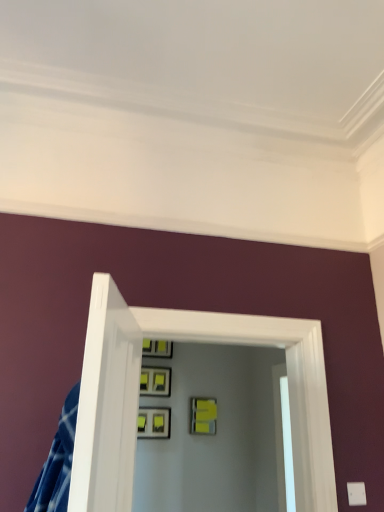
Question: Considering the positions of point (132, 423) and point (157, 375), is point (132, 423) closer or farther from the camera than point (157, 375)?

Choices:
 (A) farther
 (B) closer

Answer: (B)

Question: In terms of width, does clear glass door at center look wider or thinner when compared to matte black picture frame at center, which appears as the 3th picture frame when ordered from the bottom?

Choices:
 (A) wide
 (B) thin

Answer: (A)

Question: Which object is positioned farthest from the matte black picture frame at upper center, the first picture frame positioned from the top?

Choices:
 (A) clear glass door at center
 (B) matte gray picture frame at center, the fourth picture frame when ordered from top to bottom
 (C) matte yellow picture frame at center, positioned as the 2th picture frame in bottom-to-top order
 (D) matte black picture frame at center, the 2th picture frame viewed from the top

Answer: (A)

Question: Estimate the real-world distances between objects in this image. Which object is closer to the matte gray picture frame at center, the fourth picture frame when ordered from top to bottom?

Choices:
 (A) matte black picture frame at upper center, which is the fourth picture frame in bottom-to-top order
 (B) matte yellow picture frame at center, positioned as the 2th picture frame in bottom-to-top order
 (C) clear glass door at center
 (D) matte black picture frame at center, which appears as the 3th picture frame when ordered from the bottom

Answer: (D)